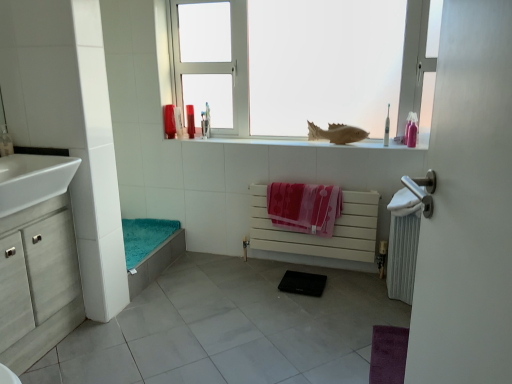
Question: Would you say matte brown fish at upper center contains white matte radiator at center, marked as the 2th radiator in a right-to-left arrangement?

Choices:
 (A) yes
 (B) no

Answer: (B)

Question: Does matte brown fish at upper center have a greater width compared to white matte radiator at center, which ranks as the first radiator in left-to-right order?

Choices:
 (A) no
 (B) yes

Answer: (A)

Question: Can you see matte brown fish at upper center touching white matte radiator at center, which ranks as the first radiator in left-to-right order?

Choices:
 (A) yes
 (B) no

Answer: (B)

Question: Is matte brown fish at upper center facing away from white matte radiator at center, which ranks as the first radiator in left-to-right order?

Choices:
 (A) yes
 (B) no

Answer: (B)

Question: Is matte brown fish at upper center at the left side of white matte radiator at center, which ranks as the first radiator in left-to-right order?

Choices:
 (A) yes
 (B) no

Answer: (B)

Question: Is matte brown fish at upper center positioned far away from white matte radiator at center, marked as the 2th radiator in a right-to-left arrangement?

Choices:
 (A) no
 (B) yes

Answer: (A)

Question: Is white metallic radiator at right, which is counted as the 1th radiator, starting from the right, to the left of pink plastic toothbrush at upper right, placed as the 5th toiletry when sorted from left to right, from the viewer's perspective?

Choices:
 (A) no
 (B) yes

Answer: (A)

Question: Is white metallic radiator at right, which is counted as the 1th radiator, starting from the right, directly adjacent to pink plastic toothbrush at upper right, placed as the 5th toiletry when sorted from left to right?

Choices:
 (A) yes
 (B) no

Answer: (B)

Question: Is white metallic radiator at right, acting as the second radiator starting from the left, taller than pink plastic toothbrush at upper right, which ranks as the 3th toiletry in front-to-back order?

Choices:
 (A) yes
 (B) no

Answer: (A)

Question: Can you confirm if white metallic radiator at right, which is counted as the 1th radiator, starting from the right, is shorter than pink plastic toothbrush at upper right, placed as the 5th toiletry when sorted from left to right?

Choices:
 (A) yes
 (B) no

Answer: (B)

Question: Can you confirm if white metallic radiator at right, which is counted as the 1th radiator, starting from the right, is positioned to the right of pink plastic toothbrush at upper right, the 2th toiletry from the right?

Choices:
 (A) no
 (B) yes

Answer: (B)

Question: From the image's perspective, does white metallic radiator at right, acting as the second radiator starting from the left, appear lower than pink plastic toothbrush at upper right, which ranks as the 3th toiletry in front-to-back order?

Choices:
 (A) yes
 (B) no

Answer: (A)

Question: Considering the relative sizes of white metallic radiator at right, which is counted as the 1th radiator, starting from the right, and white glossy sink at left in the image provided, is white metallic radiator at right, which is counted as the 1th radiator, starting from the right, taller than white glossy sink at left?

Choices:
 (A) yes
 (B) no

Answer: (A)